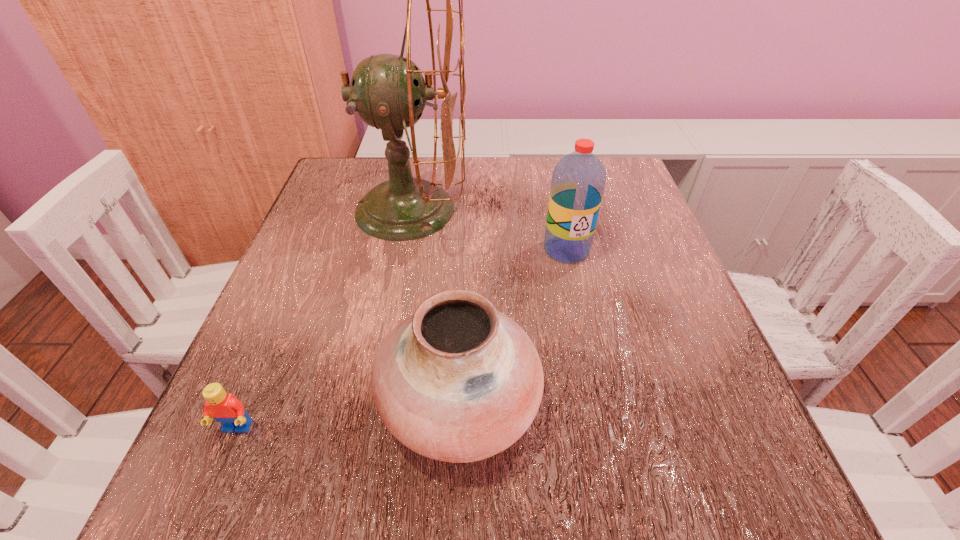
Identify the location of free region at the far left corner. (331, 206).

This screenshot has height=540, width=960. In the image, there is a desktop. What are the coordinates of `vacant space at the far right corner` in the screenshot? It's located at click(597, 158).

This screenshot has height=540, width=960. I want to click on free space between the fan and the water bottle, so click(489, 230).

The height and width of the screenshot is (540, 960). I want to click on free spot between the Lego and the pottery, so click(x=348, y=415).

At what (x,y) coordinates should I click in order to perform the action: click on free space between the leftmost object and the pottery. Please return your answer as a coordinate pair (x, y). The height and width of the screenshot is (540, 960). Looking at the image, I should click on click(x=348, y=415).

At what (x,y) coordinates should I click in order to perform the action: click on vacant area that lies between the water bottle and the tallest object. Please return your answer as a coordinate pair (x, y). This screenshot has width=960, height=540. Looking at the image, I should click on (489, 230).

In order to click on vacant area that lies between the tallest object and the Lego in this screenshot , I will do `click(324, 319)`.

Select which object appears as the closest to the fan. Please provide its 2D coordinates. Your answer should be formatted as a tuple, i.e. [(x, y)], where the tuple contains the x and y coordinates of a point satisfying the conditions above.

[(578, 181)]

At what (x,y) coordinates should I click in order to perform the action: click on object that stands as the second closest to the leftmost object. Please return your answer as a coordinate pair (x, y). Looking at the image, I should click on (388, 92).

Where is `free space that satisfies the following two spatial constraints: 1. in front of the fan, directing air flow; 2. on the left side of the pottery`? This screenshot has height=540, width=960. free space that satisfies the following two spatial constraints: 1. in front of the fan, directing air flow; 2. on the left side of the pottery is located at coordinates (374, 401).